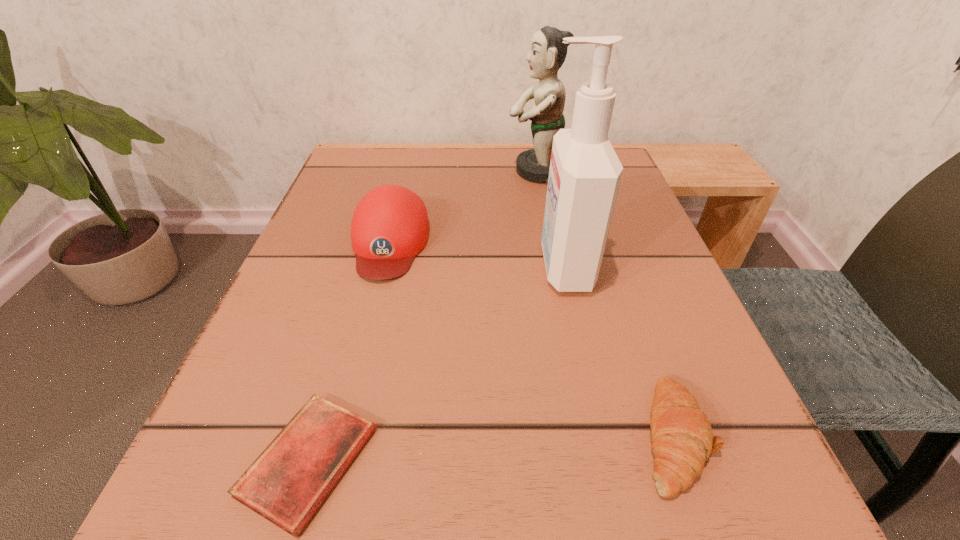
Where is `cleansing agent that is positioned at the right edge`? Image resolution: width=960 pixels, height=540 pixels. cleansing agent that is positioned at the right edge is located at coordinates (584, 177).

The width and height of the screenshot is (960, 540). Find the location of `figurine located in the right edge section of the desktop`. figurine located in the right edge section of the desktop is located at coordinates (547, 54).

This screenshot has height=540, width=960. What are the coordinates of `crescent roll located at the right edge` in the screenshot? It's located at (682, 438).

Find the location of a particular element. The image size is (960, 540). object that is positioned at the near left corner is located at coordinates (287, 483).

Find the location of a particular element. The image size is (960, 540). object that is at the far right corner is located at coordinates (547, 54).

Identify the location of object that is at the near right corner. (682, 438).

Image resolution: width=960 pixels, height=540 pixels. Find the location of `vacant space at the far edge of the desktop`. vacant space at the far edge of the desktop is located at coordinates (443, 167).

Where is `vacant space at the near edge of the desktop`? This screenshot has height=540, width=960. vacant space at the near edge of the desktop is located at coordinates (615, 519).

The height and width of the screenshot is (540, 960). In order to click on vacant region at the left edge of the desktop in this screenshot , I will do `click(255, 457)`.

At what (x,y) coordinates should I click in order to perform the action: click on free space at the right edge. Please return your answer as a coordinate pair (x, y). Looking at the image, I should click on (644, 371).